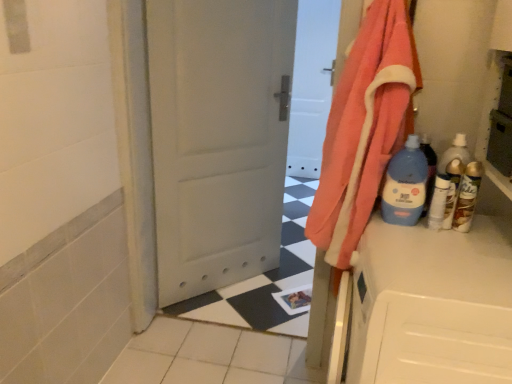
Question: From a real-world perspective, does clear plastic bottle at right, the third bottle positioned from the left, stand above blue plastic bottle at right, placed as the 4th bottle when sorted from right to left?

Choices:
 (A) no
 (B) yes

Answer: (A)

Question: From a real-world perspective, is clear plastic bottle at right, the third bottle positioned from the left, below blue plastic bottle at right, placed as the 1th bottle when sorted from left to right?

Choices:
 (A) no
 (B) yes

Answer: (B)

Question: Is the surface of clear plastic bottle at right, which is the second bottle in right-to-left order, in direct contact with blue plastic bottle at right, placed as the 4th bottle when sorted from right to left?

Choices:
 (A) no
 (B) yes

Answer: (A)

Question: From the image's perspective, is clear plastic bottle at right, the third bottle positioned from the left, located beneath blue plastic bottle at right, placed as the 1th bottle when sorted from left to right?

Choices:
 (A) yes
 (B) no

Answer: (A)

Question: Is clear plastic bottle at right, the third bottle positioned from the left, looking in the opposite direction of blue plastic bottle at right, placed as the 4th bottle when sorted from right to left?

Choices:
 (A) yes
 (B) no

Answer: (B)

Question: From the image's perspective, is clear plastic bottle at right, the third bottle positioned from the left, on blue plastic bottle at right, placed as the 1th bottle when sorted from left to right?

Choices:
 (A) yes
 (B) no

Answer: (B)

Question: Can you confirm if gold metallic spray can at right, marked as the fourth bottle in a left-to-right arrangement, is shorter than orange cotton towel at right?

Choices:
 (A) yes
 (B) no

Answer: (A)

Question: From the image's perspective, does gold metallic spray can at right, marked as the fourth bottle in a left-to-right arrangement, appear lower than orange cotton towel at right?

Choices:
 (A) no
 (B) yes

Answer: (B)

Question: Considering the relative sizes of gold metallic spray can at right, placed as the first bottle when sorted from right to left, and orange cotton towel at right in the image provided, is gold metallic spray can at right, placed as the first bottle when sorted from right to left, bigger than orange cotton towel at right?

Choices:
 (A) no
 (B) yes

Answer: (A)

Question: Would you say gold metallic spray can at right, marked as the fourth bottle in a left-to-right arrangement, contains orange cotton towel at right?

Choices:
 (A) no
 (B) yes

Answer: (A)

Question: From the image's perspective, is gold metallic spray can at right, placed as the first bottle when sorted from right to left, over orange cotton towel at right?

Choices:
 (A) no
 (B) yes

Answer: (A)

Question: Is gold metallic spray can at right, placed as the first bottle when sorted from right to left, at the right side of orange cotton towel at right?

Choices:
 (A) no
 (B) yes

Answer: (B)

Question: Is the depth of orange cotton towel at right less than that of white glossy bottle at right, arranged as the 3th bottle when viewed from the right?

Choices:
 (A) no
 (B) yes

Answer: (B)